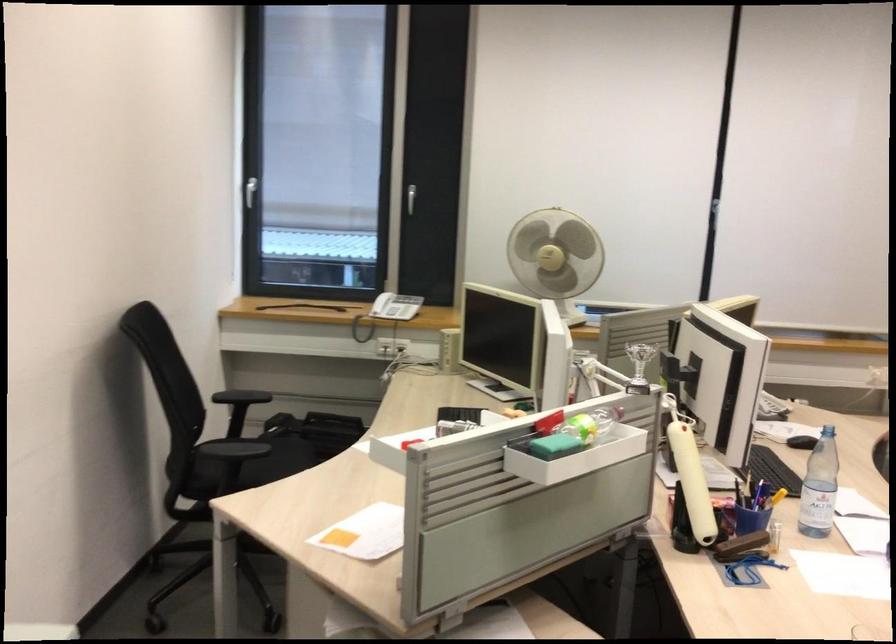
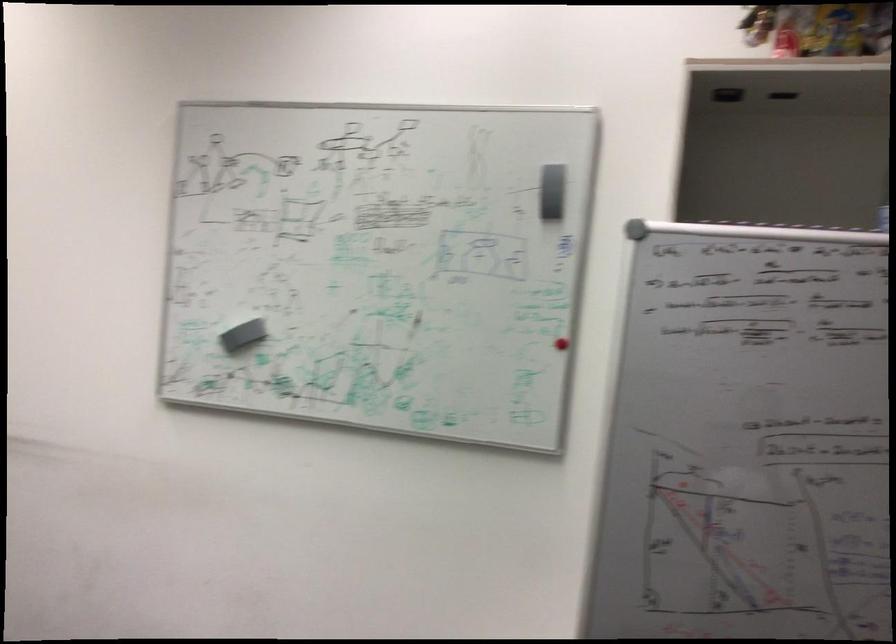
Question: The camera is either moving clockwise (left) or counter-clockwise (right) around the object. The first image is from the beginning of the video and the second image is from the end. Is the camera moving left or right when shooting the video?

Choices:
 (A) Left
 (B) Right

Answer: (A)